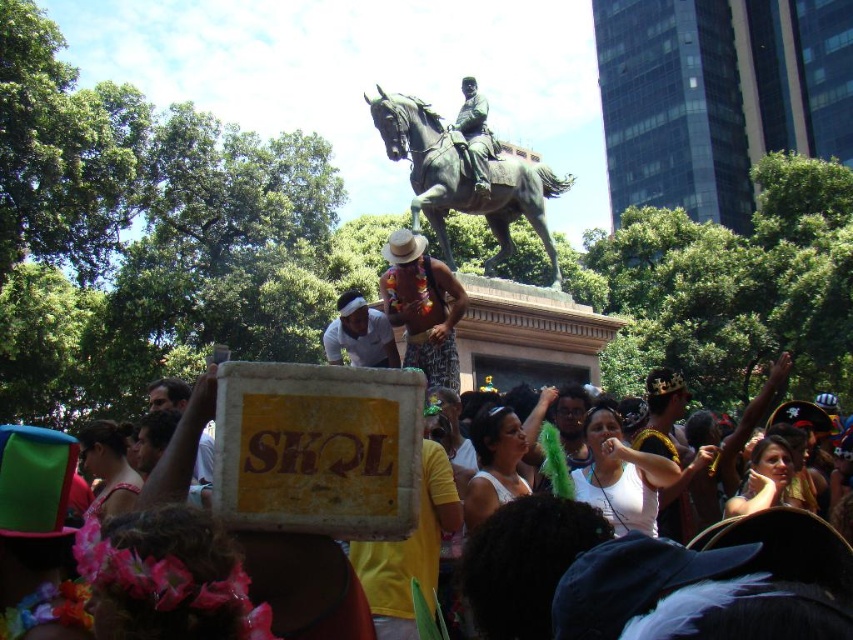
Can you confirm if bronze/statue at center is positioned above white cardboard sign at center?

Correct, bronze/statue at center is located above white cardboard sign at center.

Is point (512, 179) closer to camera compared to point (259, 593)?

No, it is not.

Is point (505, 156) positioned before point (181, 464)?

No.

You are a GUI agent. You are given a task and a screenshot of the screen. Output one action in this format:
    pyautogui.click(x=<x>, y=<y>)
    Task: Click on the bronze/statue at center
    
    Given the screenshot: What is the action you would take?
    pyautogui.click(x=463, y=179)

Which is more to the left, white cardboard sign at center or printed fabric dress at center?

From the viewer's perspective, printed fabric dress at center appears more on the left side.

From the picture: Who is higher up, white cardboard sign at center or printed fabric dress at center?

printed fabric dress at center

Which is behind, point (149, 474) or point (434, 282)?

Point (434, 282)

Image resolution: width=853 pixels, height=640 pixels. Find the location of `white cardboard sign at center`. white cardboard sign at center is located at coordinates (180, 449).

Between white matte shirt at center and bronze statue at center, which one appears on the left side from the viewer's perspective?

white matte shirt at center

Can you confirm if white matte shirt at center is bigger than bronze statue at center?

Indeed, white matte shirt at center has a larger size compared to bronze statue at center.

Locate an element on the screen. white matte shirt at center is located at coordinates (358, 333).